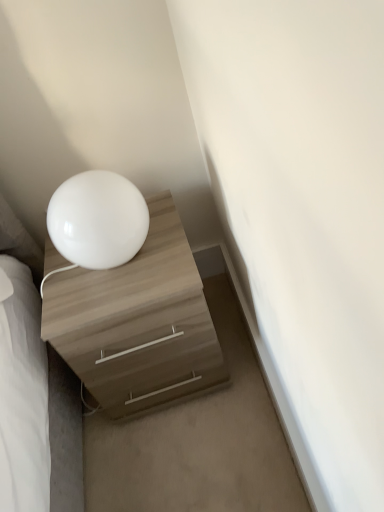
In order to face matte wood chest of drawers at lower left, should I rotate leftwards or rightwards?

Rotate left and turn 6.865 degrees.

The image size is (384, 512). In order to click on matte wood chest of drawers at lower left in this screenshot , I will do `click(137, 322)`.

Image resolution: width=384 pixels, height=512 pixels. What do you see at coordinates (137, 322) in the screenshot?
I see `matte wood chest of drawers at lower left` at bounding box center [137, 322].

This screenshot has width=384, height=512. What do you see at coordinates (96, 221) in the screenshot?
I see `white glossy table lamp at upper left` at bounding box center [96, 221].

The width and height of the screenshot is (384, 512). In order to click on white glossy table lamp at upper left in this screenshot , I will do `click(96, 221)`.

The height and width of the screenshot is (512, 384). Identify the location of matte wood chest of drawers at lower left. (137, 322).

Can you confirm if white glossy table lamp at upper left is positioned to the left of matte wood chest of drawers at lower left?

Indeed, white glossy table lamp at upper left is positioned on the left side of matte wood chest of drawers at lower left.

In the scene shown: Considering the positions of objects white glossy table lamp at upper left and matte wood chest of drawers at lower left in the image provided, who is in front, white glossy table lamp at upper left or matte wood chest of drawers at lower left?

white glossy table lamp at upper left is closer to the camera.

Is point (58, 222) more distant than point (180, 266)?

No, it is in front of (180, 266).

From the image's perspective, is white glossy table lamp at upper left positioned above or below matte wood chest of drawers at lower left?

Based on their image positions, white glossy table lamp at upper left is located above matte wood chest of drawers at lower left.

From a real-world perspective, is white glossy table lamp at upper left above or below matte wood chest of drawers at lower left?

From a real-world perspective, white glossy table lamp at upper left is physically above matte wood chest of drawers at lower left.

Which of these two, white glossy table lamp at upper left or matte wood chest of drawers at lower left, is thinner?

white glossy table lamp at upper left.

From their relative heights in the image, would you say white glossy table lamp at upper left is taller or shorter than matte wood chest of drawers at lower left?

Clearly, white glossy table lamp at upper left is shorter compared to matte wood chest of drawers at lower left.

Can you confirm if white glossy table lamp at upper left is smaller than matte wood chest of drawers at lower left?

Indeed, white glossy table lamp at upper left has a smaller size compared to matte wood chest of drawers at lower left.

Would you say matte wood chest of drawers at lower left is part of white glossy table lamp at upper left's contents?

No.

Is white glossy table lamp at upper left beside matte wood chest of drawers at lower left?

No, white glossy table lamp at upper left is not making contact with matte wood chest of drawers at lower left.

Could you tell me if white glossy table lamp at upper left is facing matte wood chest of drawers at lower left?

No, white glossy table lamp at upper left is not turned towards matte wood chest of drawers at lower left.

How many degrees apart are the facing directions of white glossy table lamp at upper left and matte wood chest of drawers at lower left?

The angle between the facing direction of white glossy table lamp at upper left and the facing direction of matte wood chest of drawers at lower left is 0.00144 degrees.

Measure the distance between white glossy table lamp at upper left and matte wood chest of drawers at lower left.

white glossy table lamp at upper left is 7.79 inches from matte wood chest of drawers at lower left.

What are the coordinates of `the chest of drawers below the white glossy table lamp at upper left (from the image's perspective)` in the screenshot? It's located at (137, 322).

Would you say matte wood chest of drawers at lower left is to the left or to the right of white glossy table lamp at upper left in the picture?

From the image, it's evident that matte wood chest of drawers at lower left is to the right of white glossy table lamp at upper left.

Is matte wood chest of drawers at lower left positioned in front of white glossy table lamp at upper left?

No.

Which point is more distant from viewer, (166, 266) or (71, 238)?

Point (166, 266)

From the image's perspective, is matte wood chest of drawers at lower left on white glossy table lamp at upper left?

Actually, matte wood chest of drawers at lower left appears below white glossy table lamp at upper left in the image.

From a real-world perspective, does matte wood chest of drawers at lower left stand above white glossy table lamp at upper left?

No.

Considering the sizes of matte wood chest of drawers at lower left and white glossy table lamp at upper left in the image, is matte wood chest of drawers at lower left wider or thinner than white glossy table lamp at upper left?

matte wood chest of drawers at lower left is wider than white glossy table lamp at upper left.

Looking at this image, considering the relative sizes of matte wood chest of drawers at lower left and white glossy table lamp at upper left in the image provided, is matte wood chest of drawers at lower left taller than white glossy table lamp at upper left?

Yes.

Considering the sizes of objects matte wood chest of drawers at lower left and white glossy table lamp at upper left in the image provided, who is bigger, matte wood chest of drawers at lower left or white glossy table lamp at upper left?

With larger size is matte wood chest of drawers at lower left.

Is white glossy table lamp at upper left inside matte wood chest of drawers at lower left?

No, white glossy table lamp at upper left is not inside matte wood chest of drawers at lower left.

Would you say matte wood chest of drawers at lower left is a long distance from white glossy table lamp at upper left?

That's not correct — matte wood chest of drawers at lower left is a little close to white glossy table lamp at upper left.

Is matte wood chest of drawers at lower left aimed at white glossy table lamp at upper left?

No, matte wood chest of drawers at lower left does not turn towards white glossy table lamp at upper left.

Consider the image. Can you tell me how much matte wood chest of drawers at lower left and white glossy table lamp at upper left differ in facing direction?

0.00144 degrees.

Measure the distance between matte wood chest of drawers at lower left and white glossy table lamp at upper left.

The distance of matte wood chest of drawers at lower left from white glossy table lamp at upper left is 7.79 inches.

In order to click on the chest of drawers lying behind the white glossy table lamp at upper left in this screenshot , I will do `click(137, 322)`.

The image size is (384, 512). I want to click on chest of drawers on the right of white glossy table lamp at upper left, so click(x=137, y=322).

Identify the location of table lamp above the matte wood chest of drawers at lower left (from the image's perspective). (96, 221).